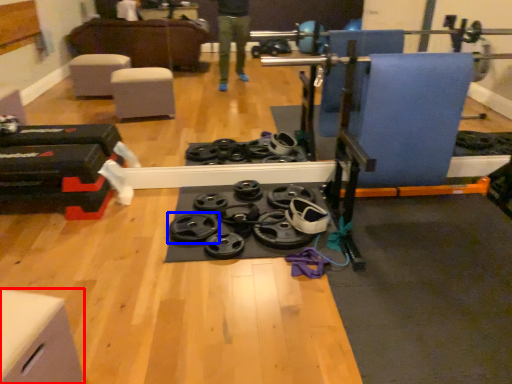
Question: Which of the following is the farthest to the observer, furniture (highlighted by a red box) or wheel (highlighted by a blue box)?

Choices:
 (A) furniture
 (B) wheel

Answer: (B)